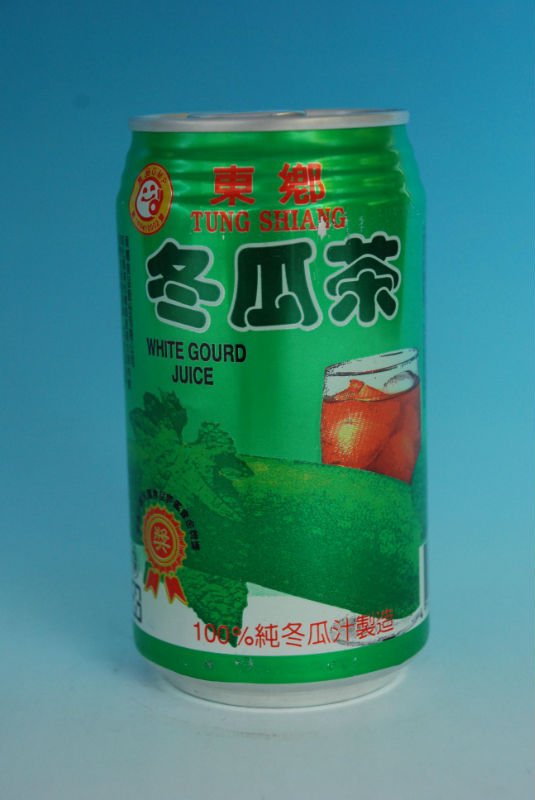
Identify the location of floor. (449, 730).